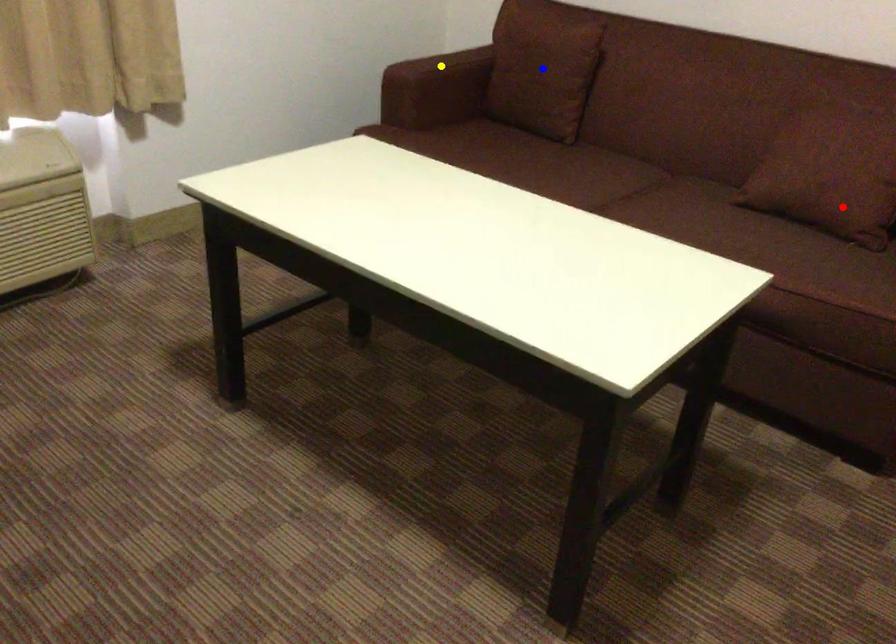
Order these from farthest to nearest:
red point | blue point | yellow point

yellow point → blue point → red point